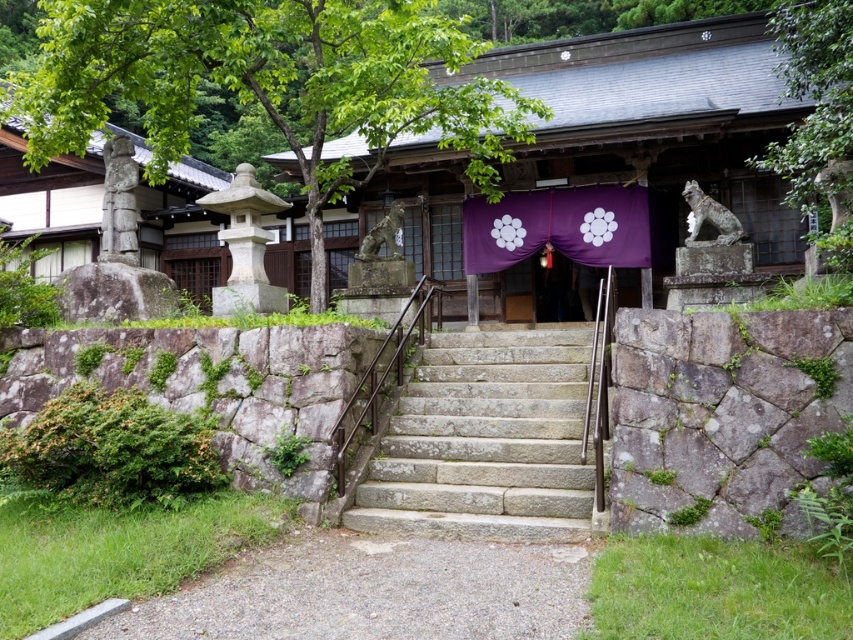
Question: Which of the following is the closest to the observer?

Choices:
 (A) (403, 477)
 (B) (608, 209)
 (C) (68, 138)

Answer: (A)

Question: Is green leafy tree at left wider than purple satin curtain at center?

Choices:
 (A) yes
 (B) no

Answer: (A)

Question: Which is farther from the green leafy tree at left?

Choices:
 (A) gray stone stairs at center
 (B) green leafy tree at upper right
 (C) purple satin curtain at center

Answer: (B)

Question: Which point is closer to the camera?

Choices:
 (A) (540, 413)
 (B) (55, 12)
 (C) (817, 65)
 (D) (625, 228)

Answer: (A)

Question: Can you confirm if green leafy tree at upper right is positioned to the right of purple satin curtain at center?

Choices:
 (A) yes
 (B) no

Answer: (A)

Question: Does green leafy tree at upper right have a larger size compared to purple satin curtain at center?

Choices:
 (A) no
 (B) yes

Answer: (B)